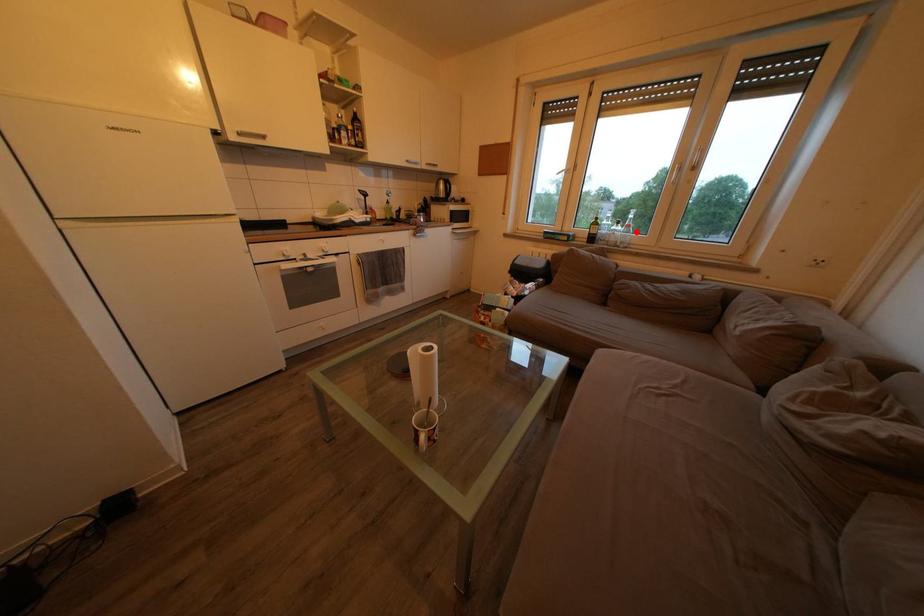
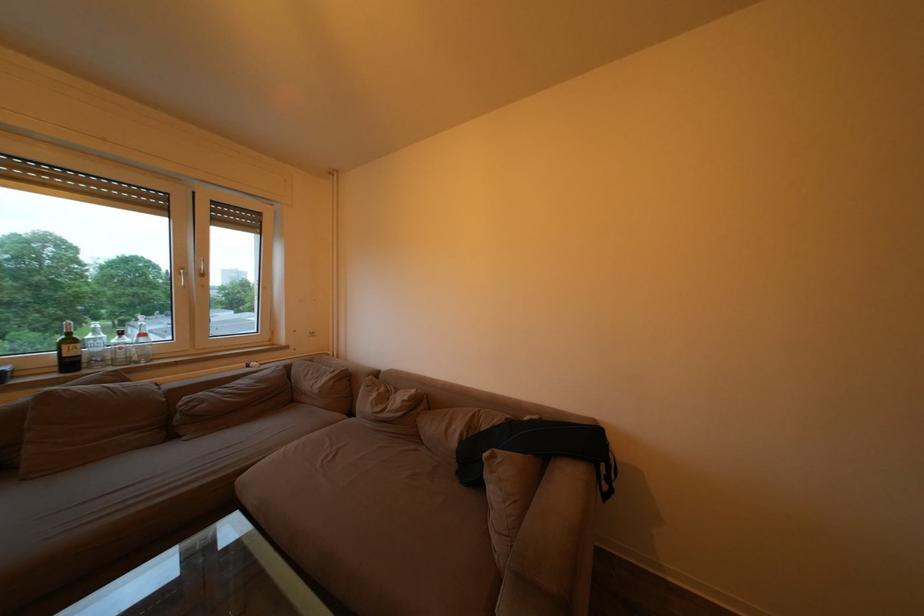
Locate, in the second image, the point that corresponds to the highlighted location in the first image.

(151, 341)